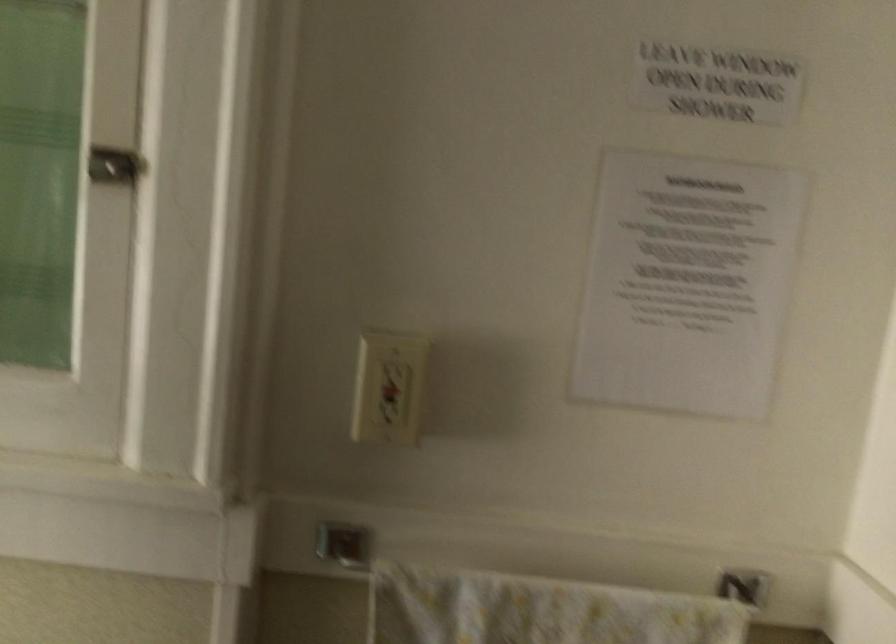
What do you see at coordinates (389, 388) in the screenshot? Image resolution: width=896 pixels, height=644 pixels. I see `a white light switch` at bounding box center [389, 388].